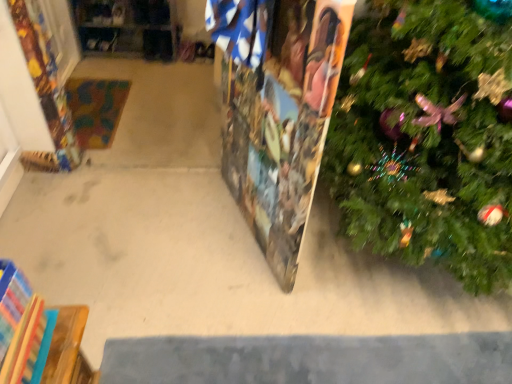
Describe the element at coordinates (426, 138) in the screenshot. I see `green textured christmas tree at right` at that location.

Locate an element on the screen. The width and height of the screenshot is (512, 384). green textured christmas tree at right is located at coordinates (426, 138).

From the picture: Considering the sizes of green textured christmas tree at right and wooden at left in the image, is green textured christmas tree at right bigger or smaller than wooden at left?

In the image, green textured christmas tree at right appears to be larger than wooden at left.

Considering the relative positions of green textured christmas tree at right and wooden at left in the image provided, is green textured christmas tree at right to the left of wooden at left from the viewer's perspective?

Incorrect, green textured christmas tree at right is not on the left side of wooden at left.

Is point (467, 235) less distant than point (173, 38)?

Yes, it is in front of point (173, 38).

Considering the sizes of objects green textured christmas tree at right and wooden at left in the image provided, who is taller, green textured christmas tree at right or wooden at left?

green textured christmas tree at right is taller.

Considering the relative sizes of wooden puzzle piece at center and green textured christmas tree at right in the image provided, is wooden puzzle piece at center smaller than green textured christmas tree at right?

Yes, wooden puzzle piece at center is smaller than green textured christmas tree at right.

From a real-world perspective, which object rests below the other?

wooden puzzle piece at center.

Looking at their sizes, would you say wooden puzzle piece at center is wider or thinner than green textured christmas tree at right?

Clearly, wooden puzzle piece at center has less width compared to green textured christmas tree at right.

Measure the distance from wooden puzzle piece at center to green textured christmas tree at right.

16.76 inches.

Consider the image. From their relative heights in the image, would you say wooden puzzle piece at center is taller or shorter than wooden at left?

wooden puzzle piece at center is taller than wooden at left.

From a real-world perspective, which is physically below, wooden puzzle piece at center or wooden at left?

wooden at left is physically lower.

Find the location of a particular element. This screenshot has height=384, width=512. shelf on the left of wooden puzzle piece at center is located at coordinates (126, 27).

Is wooden puzzle piece at center situated inside wooden at left or outside?

wooden puzzle piece at center is spatially situated outside wooden at left.

Where is `shelf below the wooden puzzle piece at center (from a real-world perspective)`? The width and height of the screenshot is (512, 384). shelf below the wooden puzzle piece at center (from a real-world perspective) is located at coordinates (126, 27).

From a real-world perspective, between wooden at left and wooden puzzle piece at center, who is vertically higher?

From a 3D spatial view, wooden puzzle piece at center is above.

Is the position of wooden at left more distant than that of wooden puzzle piece at center?

That is True.

Who is taller, wooden at left or wooden puzzle piece at center?

wooden puzzle piece at center.

Does wooden at left lie in front of green textured christmas tree at right?

No, it is not.

Where is `shelf that is under the green textured christmas tree at right (from a real-world perspective)`? This screenshot has width=512, height=384. shelf that is under the green textured christmas tree at right (from a real-world perspective) is located at coordinates (126, 27).

Is wooden at left not close to green textured christmas tree at right?

Absolutely, wooden at left is distant from green textured christmas tree at right.

Based on the photo, can you tell me how much wooden at left and green textured christmas tree at right differ in facing direction?

wooden at left and green textured christmas tree at right are facing 2.28 degrees away from each other.

Is green textured christmas tree at right positioned in front of wooden puzzle piece at center?

Yes, green textured christmas tree at right is closer to the viewer.

Is green textured christmas tree at right completely or partially outside of wooden puzzle piece at center?

That's correct, green textured christmas tree at right is outside of wooden puzzle piece at center.

Visually, is green textured christmas tree at right positioned to the left or to the right of wooden puzzle piece at center?

green textured christmas tree at right is to the right of wooden puzzle piece at center.

Identify the location of shelf above the green textured christmas tree at right (from the image's perspective). The image size is (512, 384). (126, 27).

Locate an element on the screen. The width and height of the screenshot is (512, 384). christmas tree in front of the wooden puzzle piece at center is located at coordinates (426, 138).

Looking at the image, which one is located further to wooden at left, wooden puzzle piece at center or green textured christmas tree at right?

green textured christmas tree at right is positioned further to the anchor wooden at left.

Based on their spatial positions, is wooden puzzle piece at center or wooden at left further from green textured christmas tree at right?

wooden at left lies further to green textured christmas tree at right than the other object.

Based on the photo, looking at the image, which one is located further to wooden at left, green textured christmas tree at right or wooden puzzle piece at center?

The object further to wooden at left is green textured christmas tree at right.

From the picture: When comparing their distances from wooden puzzle piece at center, does green textured christmas tree at right or wooden at left seem further?

Among the two, wooden at left is located further to wooden puzzle piece at center.

Looking at the image, which one is located closer to green textured christmas tree at right, wooden at left or wooden puzzle piece at center?

Based on the image, wooden puzzle piece at center appears to be nearer to green textured christmas tree at right.

Based on their spatial positions, is wooden at left or green textured christmas tree at right closer to wooden puzzle piece at center?

green textured christmas tree at right.

In order to click on bulletin board positioned between green textured christmas tree at right and wooden at left from near to far in this screenshot , I will do `click(283, 123)`.